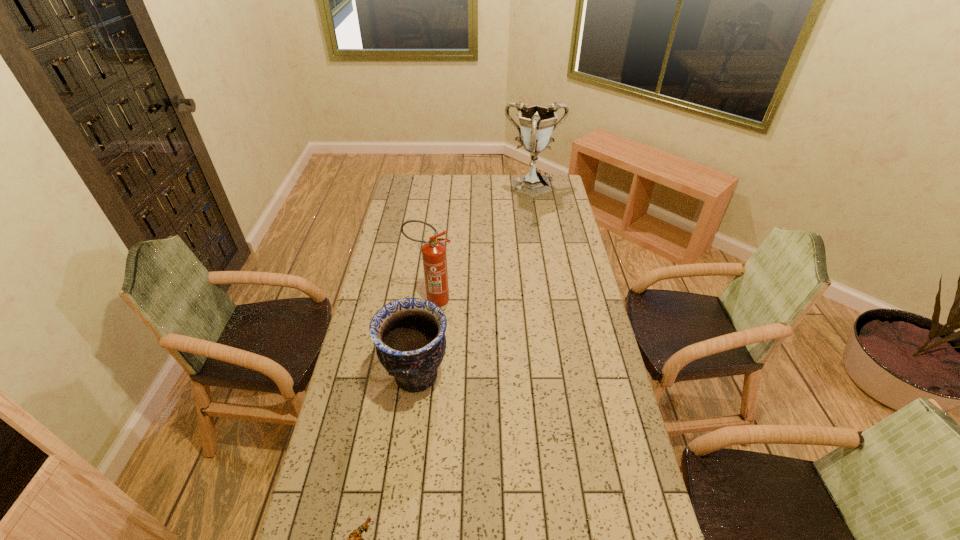
Locate an element on the screen. the rightmost object is located at coordinates (537, 123).

Find the location of a particular element. This screenshot has height=540, width=960. trophy cup is located at coordinates (537, 123).

At what (x,y) coordinates should I click in order to perform the action: click on the second farthest object. Please return your answer as a coordinate pair (x, y). The width and height of the screenshot is (960, 540). Looking at the image, I should click on (434, 257).

Locate an element on the screen. This screenshot has height=540, width=960. the second shortest object is located at coordinates (409, 334).

Where is `the third farthest object`? the third farthest object is located at coordinates [409, 334].

Locate an element on the screen. vacant area situated on the left of the trophy cup is located at coordinates (434, 188).

Where is `free space located 0.070m from the nozzle of the fire extinguisher`? This screenshot has height=540, width=960. free space located 0.070m from the nozzle of the fire extinguisher is located at coordinates (471, 300).

Find the location of a particular element. The height and width of the screenshot is (540, 960). vacant space located on the front handle of the second shortest object is located at coordinates (468, 376).

Identify the location of object that is at the far edge. Image resolution: width=960 pixels, height=540 pixels. (537, 123).

In order to click on object that is positioned at the left edge in this screenshot , I will do `click(409, 334)`.